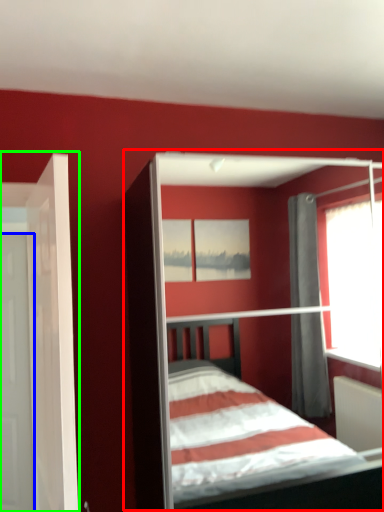
Question: Which is farther away from bed (highlighted by a red box)? door (highlighted by a blue box) or door (highlighted by a green box)?

Choices:
 (A) door
 (B) door

Answer: (B)